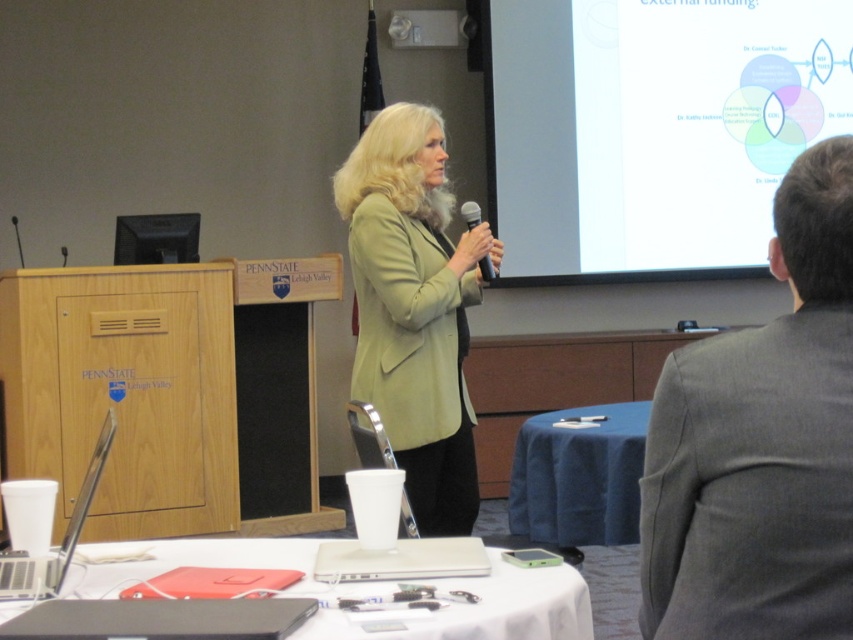
You are organizing a conference and need to place a 3.2 feet wide banner between the gray suit at upper right and the green matte blazer at center. Will there be enough space?

The distance between the gray suit at upper right and the green matte blazer at center is 5.19 feet, which is greater than the banner width of 3.2 feet. Therefore, there is enough space to place the banner between them.